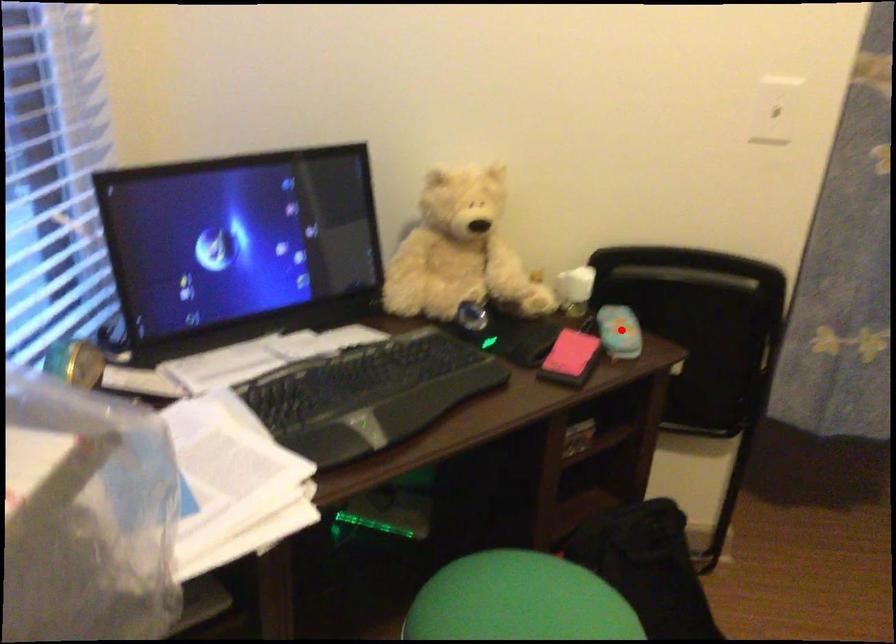
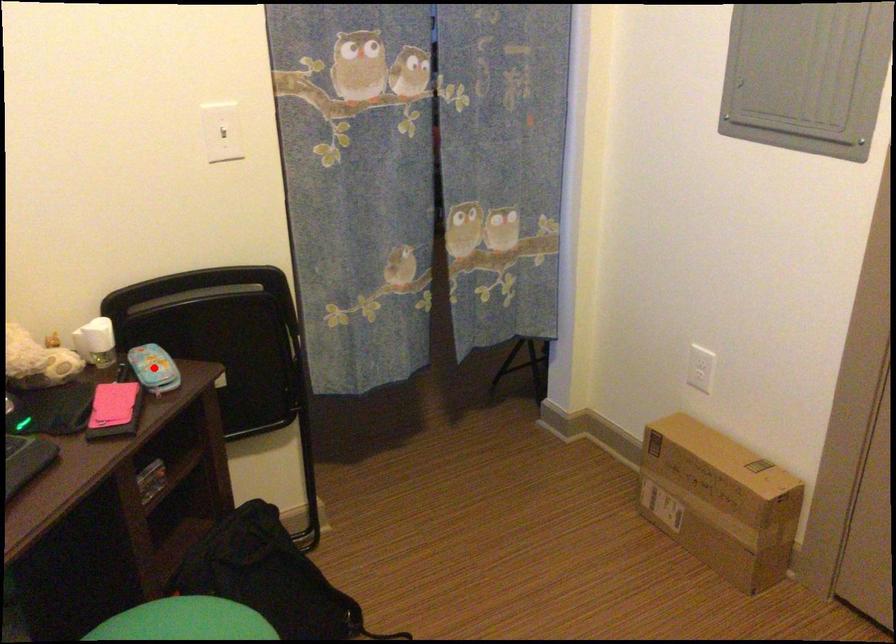
Looking at this image, I am providing you with two images of the same scene from different viewpoints. A red point is marked on the first image and another point is marked on the second image. Are the points marked in image1 and image2 representing the same 3D position?

Yes